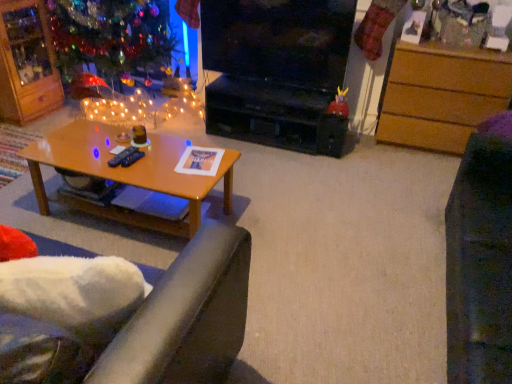
Question: Is satin blue remote control at center, which is counted as the second remote control, starting from the right, in front of or behind wooden drawer at right in the image?

Choices:
 (A) behind
 (B) front

Answer: (B)

Question: Is satin blue remote control at center, which is the 1th remote control from left to right, spatially inside wooden drawer at right, or outside of it?

Choices:
 (A) inside
 (B) outside

Answer: (B)

Question: Which is farther from the white fluffy couch at lower left?

Choices:
 (A) shiny glass christmas tree at upper left
 (B) wooden cabinet at upper left
 (C) wooden drawer at right
 (D) black plastic remote control at center, the 2th remote control viewed from the left
 (E) velvet purple swivel chair at right

Answer: (B)

Question: Considering the real-world distances, which object is closest to the black glossy television at center?

Choices:
 (A) wooden coffee table at center
 (B) black plastic remote control at center, the 2th remote control viewed from the left
 (C) white fluffy couch at lower left
 (D) shiny red toy at center
 (E) wooden drawer at right

Answer: (D)